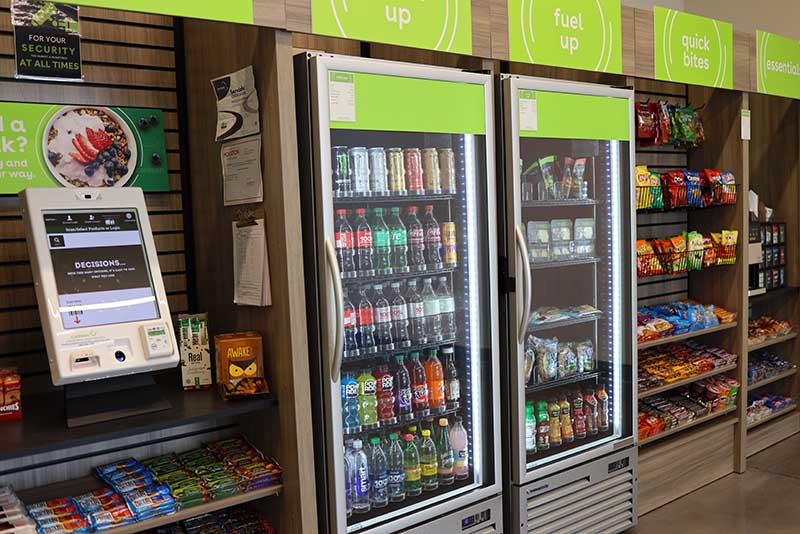
The width and height of the screenshot is (800, 534). Find the location of `floor`. floor is located at coordinates (748, 523).